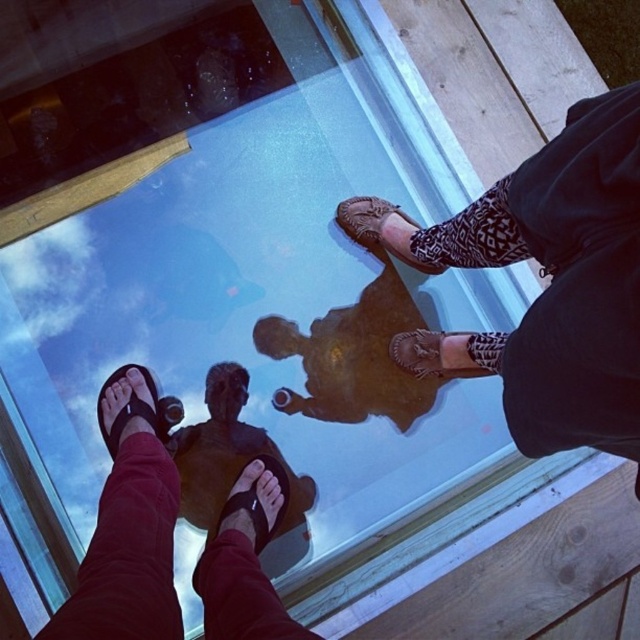
Can you confirm if brown woven sandal at center is bigger than leather textured shoe at center?

Correct, brown woven sandal at center is larger in size than leather textured shoe at center.

Between brown woven sandal at center and leather textured shoe at center, which one has more height?

With more height is leather textured shoe at center.

Who is more forward, (x=429, y=355) or (x=387, y=250)?

Point (x=429, y=355)

This screenshot has height=640, width=640. I want to click on brown woven sandal at center, so click(x=448, y=353).

Is point (577, 177) in front of point (237, 552)?

Yes.

Is point (445, 257) in front of point (228, 544)?

That is False.

This screenshot has width=640, height=640. Find the location of `brown woven sandals at center`. brown woven sandals at center is located at coordinates (548, 284).

Can you confirm if leather textured shoe at center is positioned below black leather sandal at lower left?

No.

Is the position of leather textured shoe at center more distant than that of black leather sandal at lower left?

Yes, leather textured shoe at center is behind black leather sandal at lower left.

Locate an element on the screen. This screenshot has height=640, width=640. leather textured shoe at center is located at coordinates (381, 228).